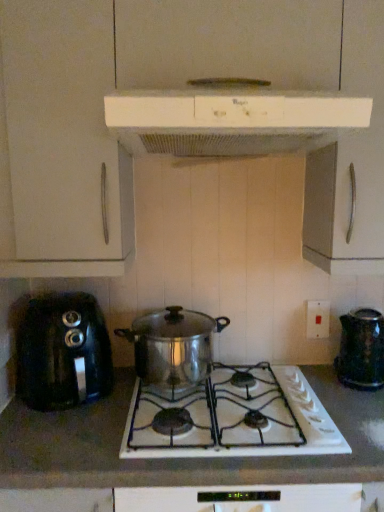
I want to click on free spot in front of shiny metallic kettle at right, marked as the fourth kitchen appliance in a left-to-right arrangement, so click(x=360, y=406).